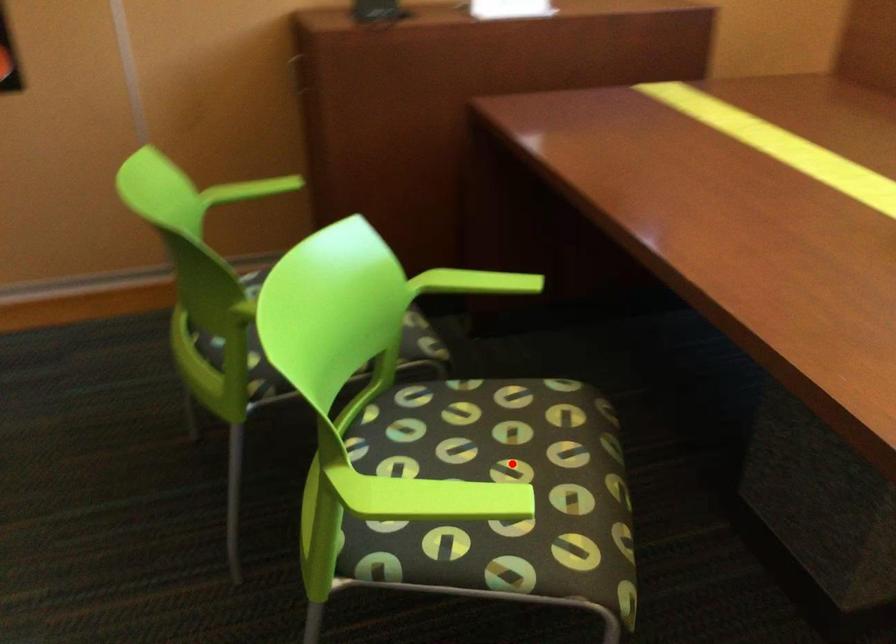
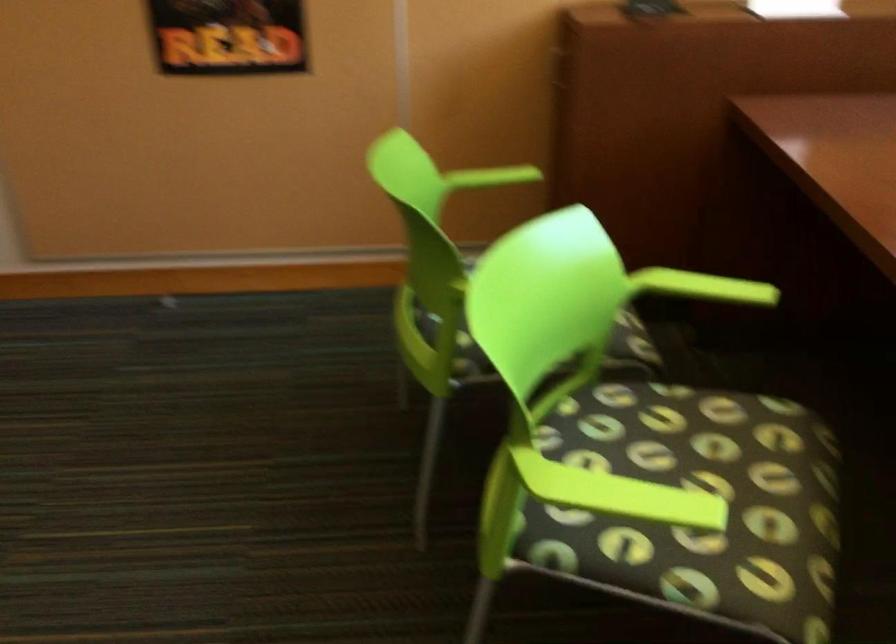
The point at the highlighted location is marked in the first image. Where is the corresponding point in the second image?

(708, 482)